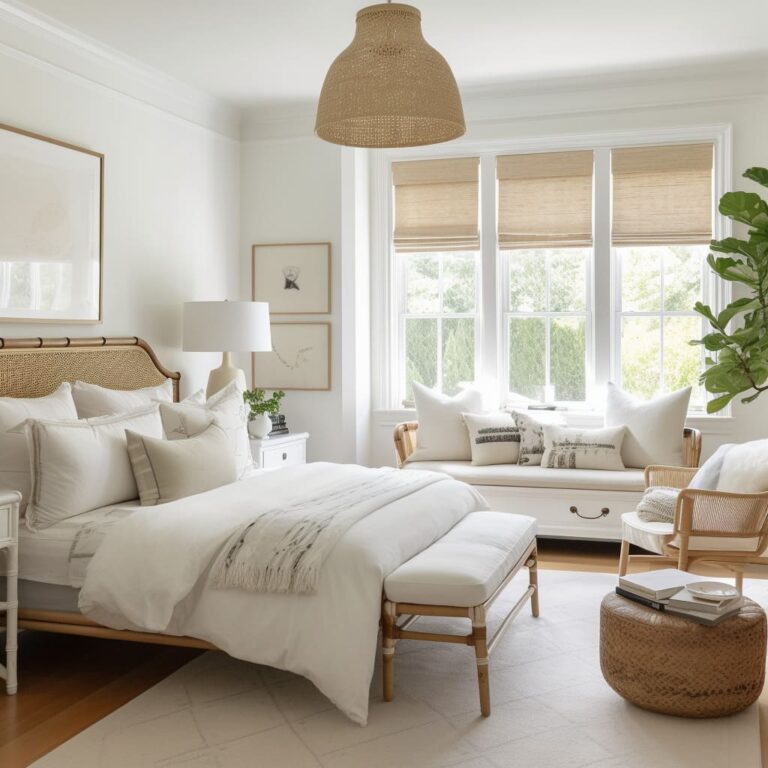
Identify the location of white walls. This screenshot has width=768, height=768. (179, 243), (259, 204).